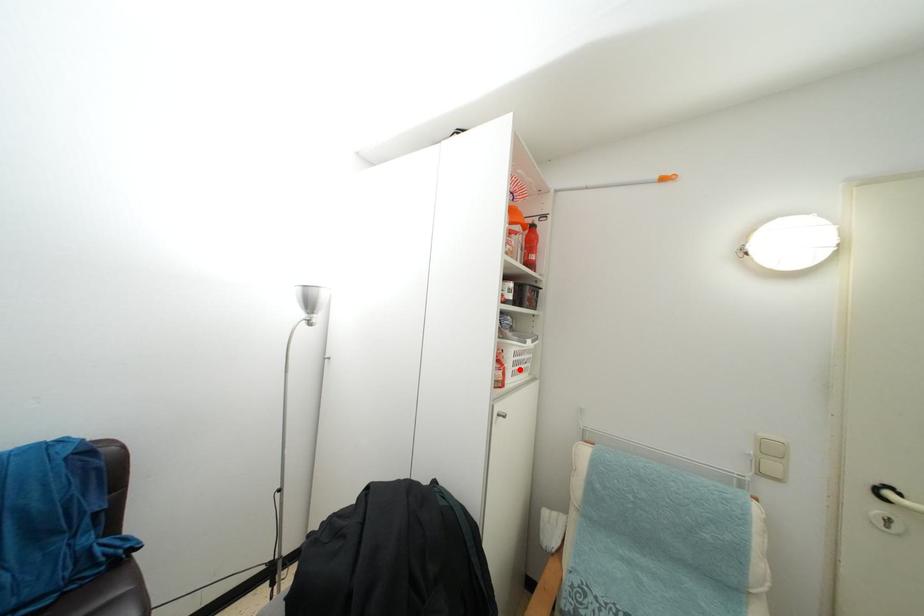
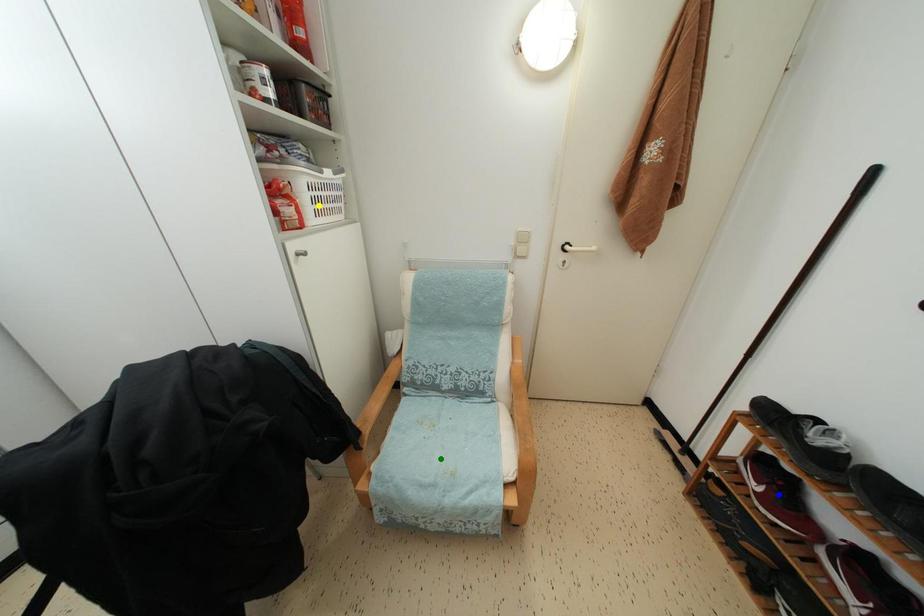
Question: I am providing you with two images of the same scene from different viewpoints. A red point is marked on the first image. You are given multiple points on the second image. Which point in image 2 represents the same 3d spot as the red point in image 1?

Choices:
 (A) yellow point
 (B) blue point
 (C) green point

Answer: (A)